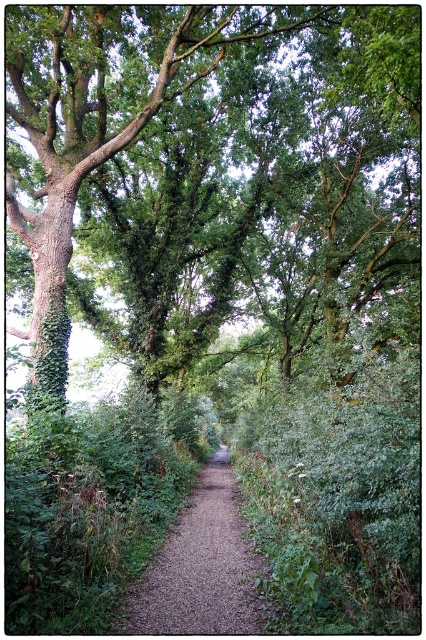
Is point (63, 333) positioned in front of point (235, 492)?

That is True.

Is green rough bark tree at upper center wider than brown gravel path at center?

Yes.

Locate an element on the screen. The width and height of the screenshot is (426, 640). green rough bark tree at upper center is located at coordinates (213, 179).